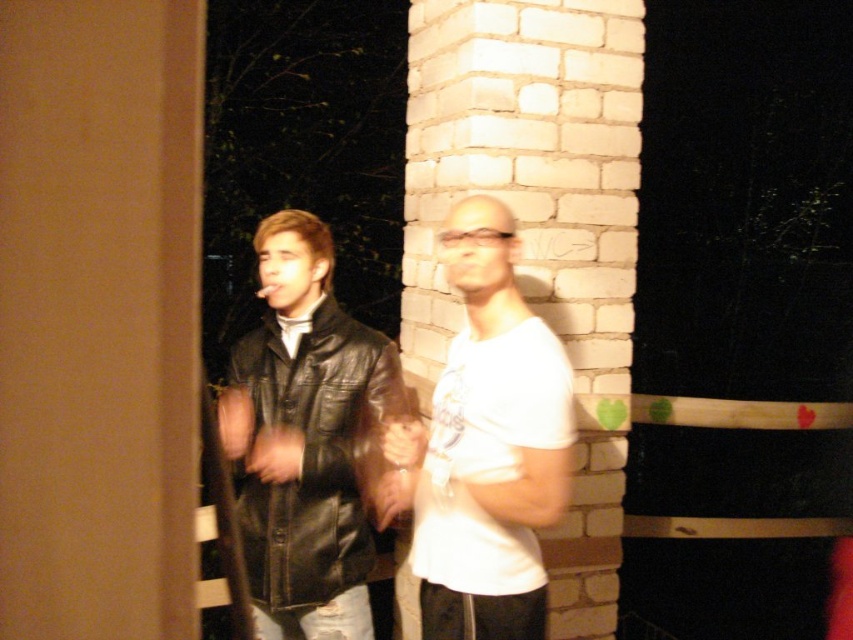
What are the coordinates of `white matte t-shirt at center` in the screenshot? It's located at (486, 445).

Between white matte t-shirt at center and black leather jacket at center, which one appears on the left side from the viewer's perspective?

black leather jacket at center

Does point (532, 468) lie in front of point (283, 552)?

Yes, point (532, 468) is in front of point (283, 552).

Where is `white matte t-shirt at center`? white matte t-shirt at center is located at coordinates (486, 445).